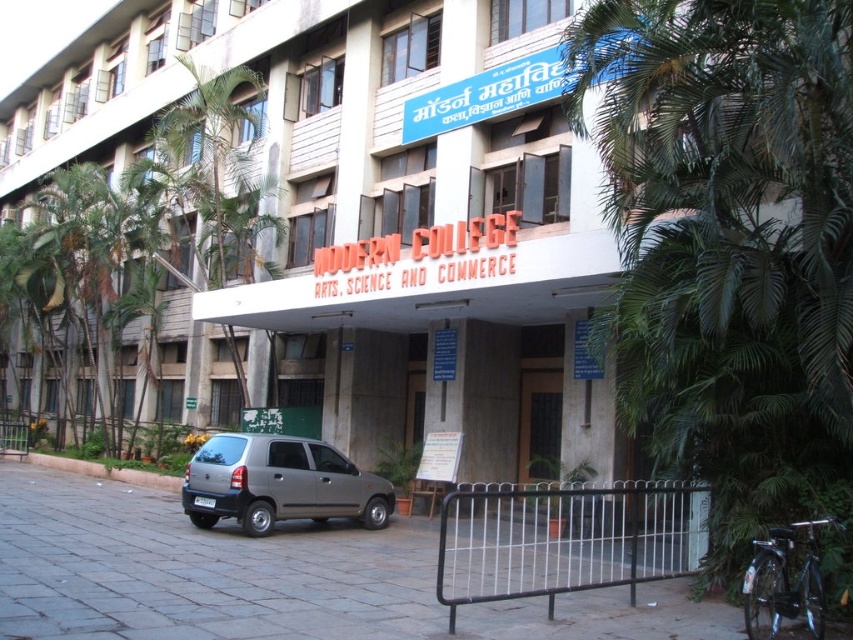
You are standing in front of the Modern College building and want to take a photo. You notice two points marked on the building facade at coordinates point (196, 189) and point (225, 435). Which point will appear closer to the camera in your photo?

Point (225, 435) will appear closer to the camera in the photo because it is closer to the viewer than point (196, 189), which is further away.